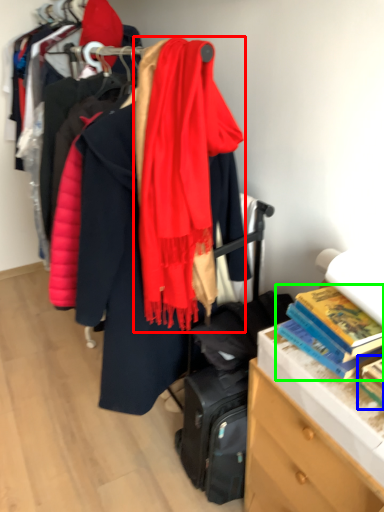
Question: Which object is the closest to the scarf (highlighted by a red box)? Choose among these: book (highlighted by a blue box) or book (highlighted by a green box).

Choices:
 (A) book
 (B) book

Answer: (B)